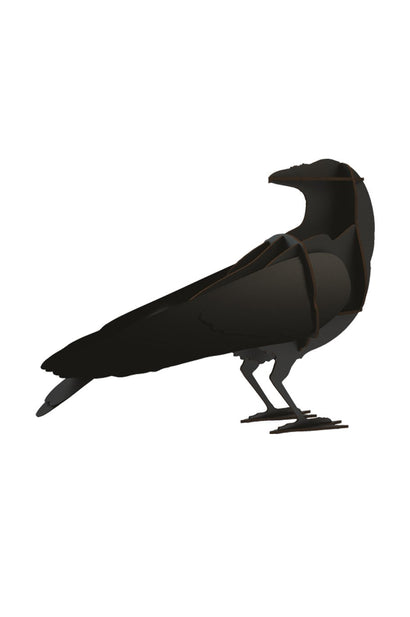
Where is `artwork`? artwork is located at coordinates (285, 278).